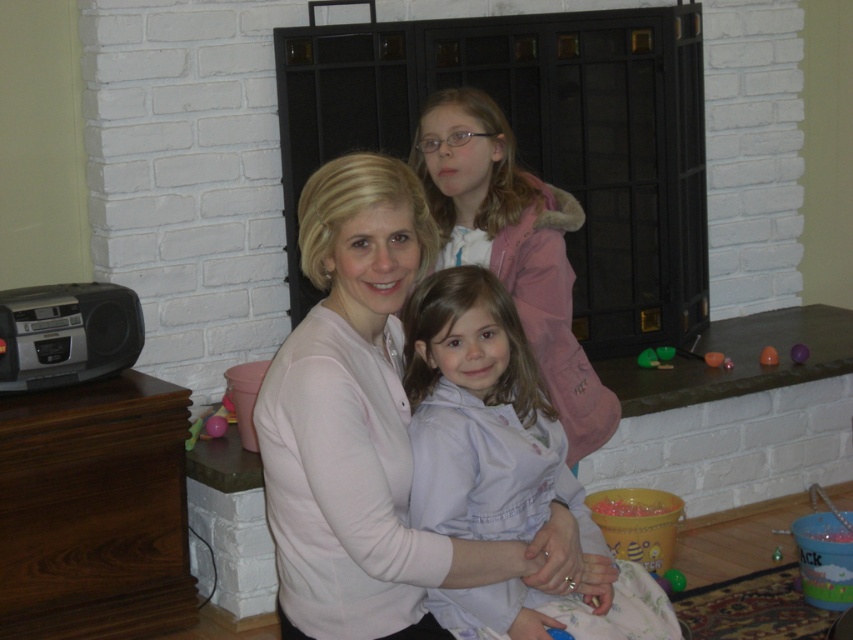
Does matte pink sweater at center lie in front of light blue fabric at center?

Yes, matte pink sweater at center is closer to the viewer.

Is matte pink sweater at center further to the viewer compared to light blue fabric at center?

No, it is in front of light blue fabric at center.

Is point (529, 579) in front of point (416, 484)?

No, (529, 579) is further to viewer.

Identify the location of matte pink sweater at center. (370, 432).